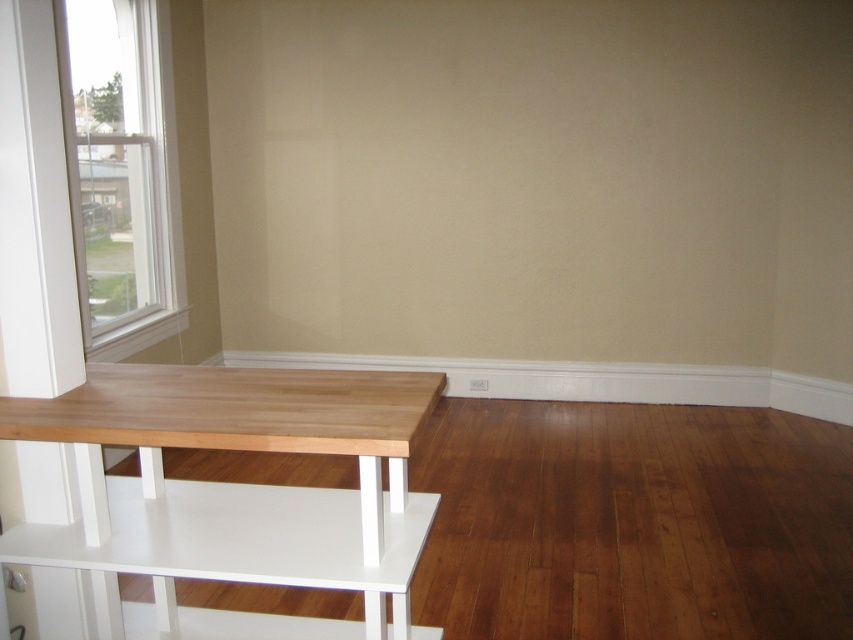
The height and width of the screenshot is (640, 853). I want to click on light wood table at left, so click(x=235, y=493).